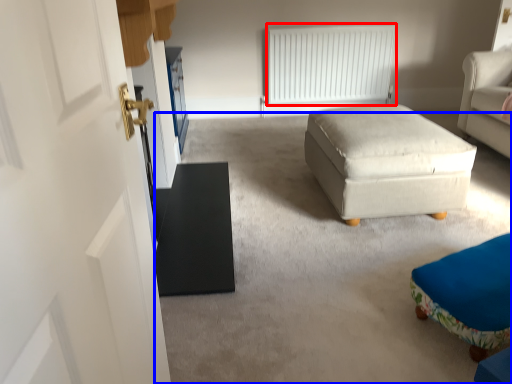
Question: Which object appears farthest to the camera in this image, radiator (highlighted by a red box) or plain (highlighted by a blue box)?

Choices:
 (A) radiator
 (B) plain

Answer: (A)